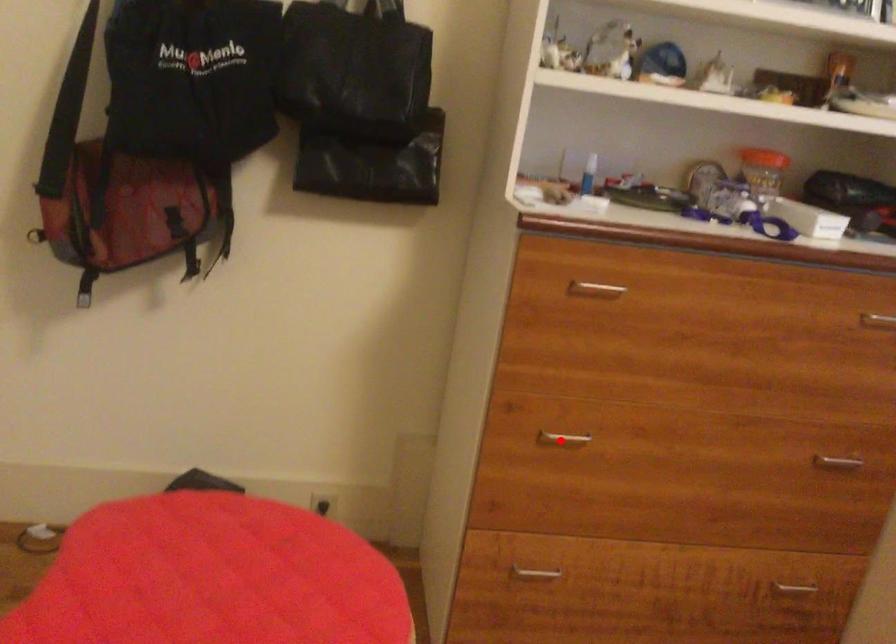
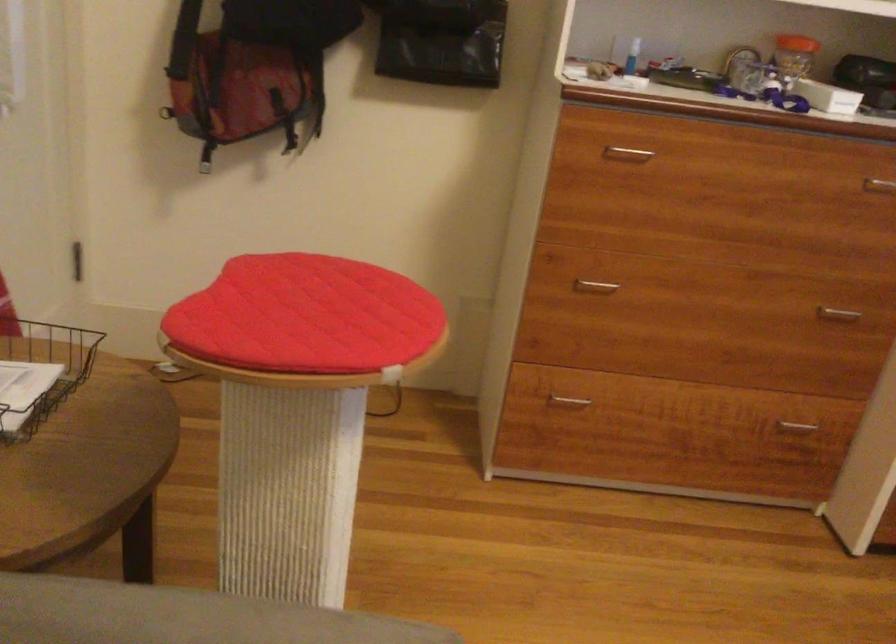
Question: I am providing you with two images of the same scene from different viewpoints. In image1, a red point is highlighted. Considering the same 3D point in image2, which of the following is correct?

Choices:
 (A) It is closer
 (B) It is farther

Answer: (B)